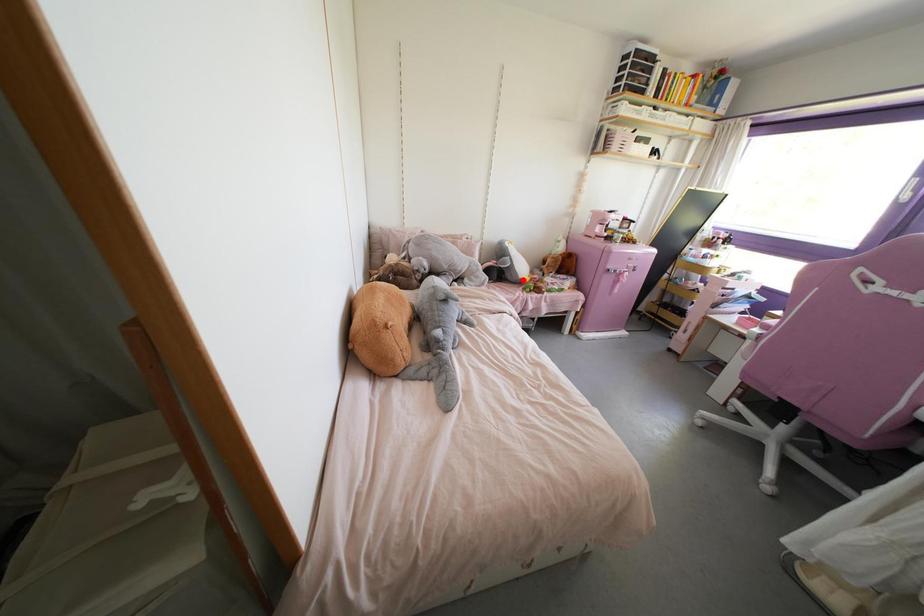
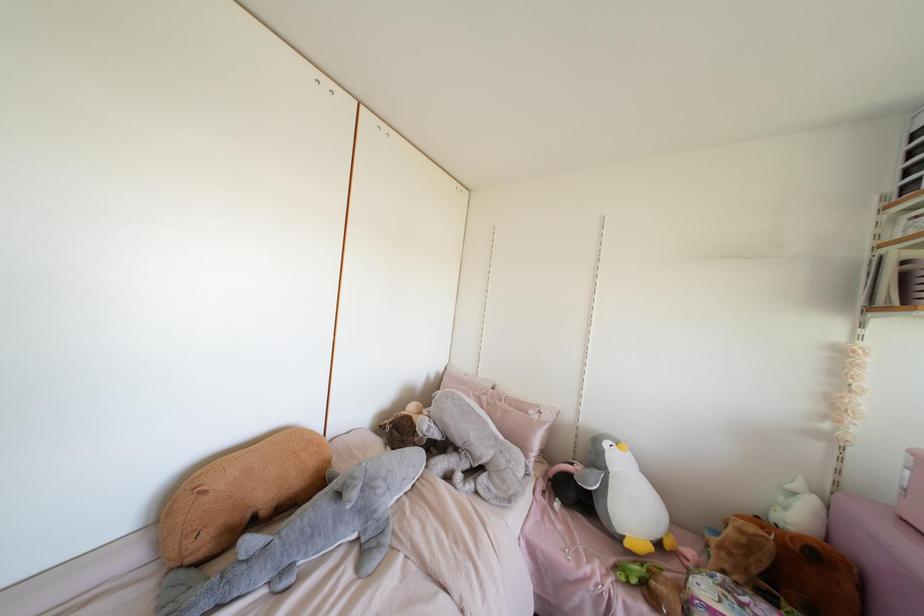
The point at the highlighted location is marked in the first image. Where is the corresponding point in the second image?

(626, 544)